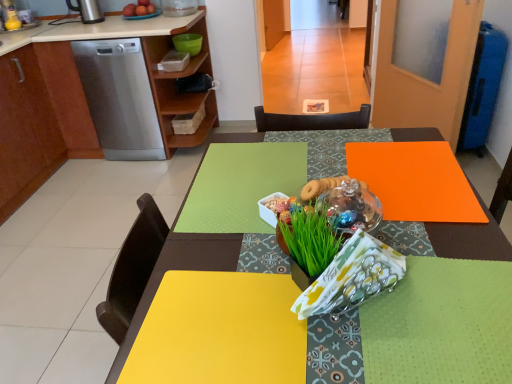
At what (x,y) coordinates should I click in order to perform the action: click on satin silver dishwasher at left. Please return your answer as a coordinate pair (x, y). Image resolution: width=512 pixels, height=384 pixels. Looking at the image, I should click on (119, 98).

Find the location of a particular element. Image resolution: width=512 pixels, height=384 pixels. metallic stainless steel kettle at upper left is located at coordinates (87, 11).

The width and height of the screenshot is (512, 384). What are the coordinates of `matte wood cabinet at left, the 2th cabinetry viewed from the right` in the screenshot? It's located at (25, 131).

Locate an element on the screen. This screenshot has height=384, width=512. green leafy grass at center is located at coordinates (309, 237).

Which of these two, metallic stainless steel kettle at upper left or yellow matte placemat at center, is thinner?

metallic stainless steel kettle at upper left is thinner.

Does metallic stainless steel kettle at upper left come behind yellow matte placemat at center?

Yes.

Is metallic stainless steel kettle at upper left aimed at yellow matte placemat at center?

Yes, metallic stainless steel kettle at upper left is aimed at yellow matte placemat at center.

From the image's perspective, is green leafy grass at center under translucent glass donuts at center?

Yes, from the image's perspective, green leafy grass at center is beneath translucent glass donuts at center.

Does green leafy grass at center have a lesser width compared to translucent glass donuts at center?

Indeed, green leafy grass at center has a lesser width compared to translucent glass donuts at center.

Is translucent glass donuts at center located within green leafy grass at center?

Actually, translucent glass donuts at center is outside green leafy grass at center.

Is green leafy grass at center placed right next to translucent glass donuts at center?

green leafy grass at center and translucent glass donuts at center are not in contact.

From a real-world perspective, between matte wood cabinet at left, the first cabinetry in the left-to-right sequence, and yellow matte placemat at center, who is vertically lower?

yellow matte placemat at center is physically lower.

Based on their sizes in the image, would you say matte wood cabinet at left, the 2th cabinetry viewed from the right, is bigger or smaller than yellow matte placemat at center?

matte wood cabinet at left, the 2th cabinetry viewed from the right, is bigger than yellow matte placemat at center.

How many degrees apart are the facing directions of matte wood cabinet at left, the 2th cabinetry viewed from the right, and yellow matte placemat at center?

179 degrees separate the facing orientations of matte wood cabinet at left, the 2th cabinetry viewed from the right, and yellow matte placemat at center.

Measure the distance between metallic stainless steel kettle at upper left and matte wood cabinet at left, which is counted as the second cabinetry, starting from the left.

metallic stainless steel kettle at upper left is 25.84 inches from matte wood cabinet at left, which is counted as the second cabinetry, starting from the left.

Which of these two, metallic stainless steel kettle at upper left or matte wood cabinet at left, which is counted as the second cabinetry, starting from the left, is smaller?

With smaller size is metallic stainless steel kettle at upper left.

Does point (84, 14) come farther from viewer compared to point (186, 94)?

No, it is not.

Which object is thinner, metallic stainless steel kettle at upper left or matte wood cabinet at left, the 1th cabinetry in the right-to-left sequence?

Thinner between the two is metallic stainless steel kettle at upper left.

From the image's perspective, is translucent glass donuts at center located above or below green leafy grass at center?

Clearly, from the image's perspective, translucent glass donuts at center is above green leafy grass at center.

Looking at this image, is translucent glass donuts at center bigger or smaller than green leafy grass at center?

Clearly, translucent glass donuts at center is smaller in size than green leafy grass at center.

Is translucent glass donuts at center at the left side of green leafy grass at center?

Incorrect, translucent glass donuts at center is not on the left side of green leafy grass at center.

Is translucent glass donuts at center not near matte wood cabinet at left, the first cabinetry in the left-to-right sequence?

Yes, translucent glass donuts at center and matte wood cabinet at left, the first cabinetry in the left-to-right sequence, are quite far apart.

Does translucent glass donuts at center lie behind matte wood cabinet at left, the first cabinetry in the left-to-right sequence?

No, the depth of translucent glass donuts at center is less than that of matte wood cabinet at left, the first cabinetry in the left-to-right sequence.

Identify the location of food lying in front of the matte wood cabinet at left, the 2th cabinetry viewed from the right. The width and height of the screenshot is (512, 384). (321, 187).

Who is taller, translucent glass donuts at center or matte wood cabinet at left, the first cabinetry in the left-to-right sequence?

matte wood cabinet at left, the first cabinetry in the left-to-right sequence, is taller.

Considering the relative sizes of green leafy grass at center and metallic stainless steel kettle at upper left in the image provided, is green leafy grass at center smaller than metallic stainless steel kettle at upper left?

Correct, green leafy grass at center occupies less space than metallic stainless steel kettle at upper left.

Which point is more forward, (287,233) or (84,12)?

The point (287,233) is in front.

Considering the sizes of objects green leafy grass at center and metallic stainless steel kettle at upper left in the image provided, who is taller, green leafy grass at center or metallic stainless steel kettle at upper left?

metallic stainless steel kettle at upper left is taller.

Is green leafy grass at center looking in the opposite direction of metallic stainless steel kettle at upper left?

No, green leafy grass at center is not facing the opposite direction of metallic stainless steel kettle at upper left.

This screenshot has width=512, height=384. In order to click on kitchen appliance on the left side of yellow matte placemat at center in this screenshot , I will do (87, 11).

Identify the location of grass located above the translucent glass donuts at center (from a real-world perspective). (309, 237).

Which object lies further to the anchor point translucent glass donuts at center, matte wood cabinet at left, the 2th cabinetry viewed from the right, or satin silver dishwasher at left?

matte wood cabinet at left, the 2th cabinetry viewed from the right, lies further to translucent glass donuts at center than the other object.

When comparing their distances from yellow matte placemat at center, does matte wood cabinet at left, the first cabinetry in the left-to-right sequence, or green matte tablecloth at center seem further?

matte wood cabinet at left, the first cabinetry in the left-to-right sequence.

When comparing their distances from matte wood cabinet at left, the 1th cabinetry in the right-to-left sequence, does metallic stainless steel kettle at upper left or matte wood cabinet at left, the first cabinetry in the left-to-right sequence, seem closer?

Among the two, matte wood cabinet at left, the first cabinetry in the left-to-right sequence, is located nearer to matte wood cabinet at left, the 1th cabinetry in the right-to-left sequence.

Based on their spatial positions, is translucent glass donuts at center or matte wood cabinet at left, the 1th cabinetry in the right-to-left sequence, further from satin silver dishwasher at left?

translucent glass donuts at center lies further to satin silver dishwasher at left than the other object.

When comparing their distances from green matte tablecloth at center, does matte wood cabinet at left, the first cabinetry in the left-to-right sequence, or matte wood cabinet at left, which is counted as the second cabinetry, starting from the left, seem closer?

Based on the image, matte wood cabinet at left, which is counted as the second cabinetry, starting from the left, appears to be nearer to green matte tablecloth at center.

Which object lies further to the anchor point satin silver dishwasher at left, matte wood cabinet at left, the 2th cabinetry viewed from the right, or yellow matte placemat at center?

yellow matte placemat at center is further to satin silver dishwasher at left.

Considering their positions, is matte wood cabinet at left, which is counted as the second cabinetry, starting from the left, positioned further to yellow matte placemat at center than translucent glass donuts at center?

matte wood cabinet at left, which is counted as the second cabinetry, starting from the left, lies further to yellow matte placemat at center than the other object.

Looking at the image, which one is located further to green matte tablecloth at center, yellow matte placemat at center or metallic stainless steel kettle at upper left?

The object further to green matte tablecloth at center is metallic stainless steel kettle at upper left.

Where is `tablecloth situated between matte wood cabinet at left, the 1th cabinetry in the right-to-left sequence, and yellow matte placemat at center from left to right`? The height and width of the screenshot is (384, 512). tablecloth situated between matte wood cabinet at left, the 1th cabinetry in the right-to-left sequence, and yellow matte placemat at center from left to right is located at coordinates (241, 186).

In order to click on home appliance positioned between translucent glass donuts at center and metallic stainless steel kettle at upper left from near to far in this screenshot , I will do `click(119, 98)`.

The image size is (512, 384). I want to click on tablecloth positioned between green leafy grass at center and satin silver dishwasher at left from near to far, so click(241, 186).

The width and height of the screenshot is (512, 384). In order to click on cabinetry between matte wood cabinet at left, the first cabinetry in the left-to-right sequence, and yellow matte placemat at center, in the horizontal direction in this screenshot , I will do `click(83, 99)`.